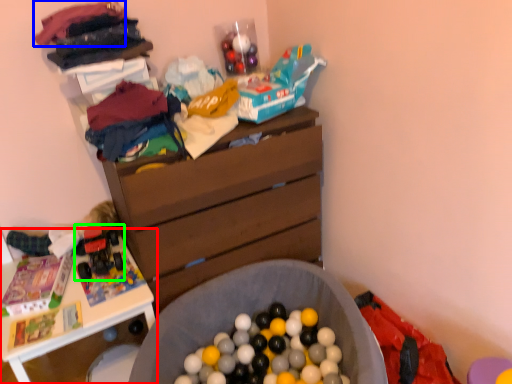
Question: Which object is positioned farthest from table (highlighted by a red box)? Select from clothing (highlighted by a blue box) and toy car (highlighted by a green box).

Choices:
 (A) clothing
 (B) toy car

Answer: (A)